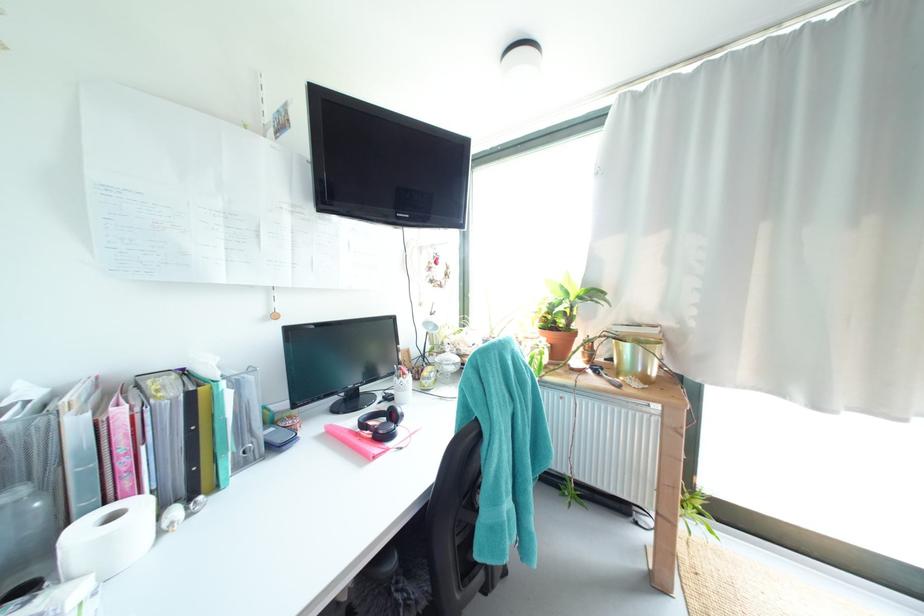
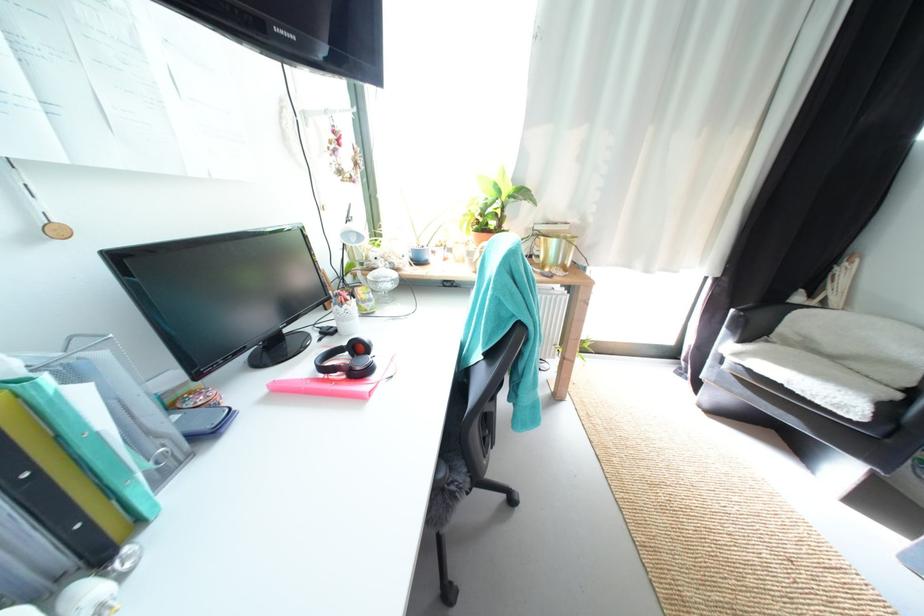
Find the pixel in the second image that matches (573,315) in the first image.

(505, 216)